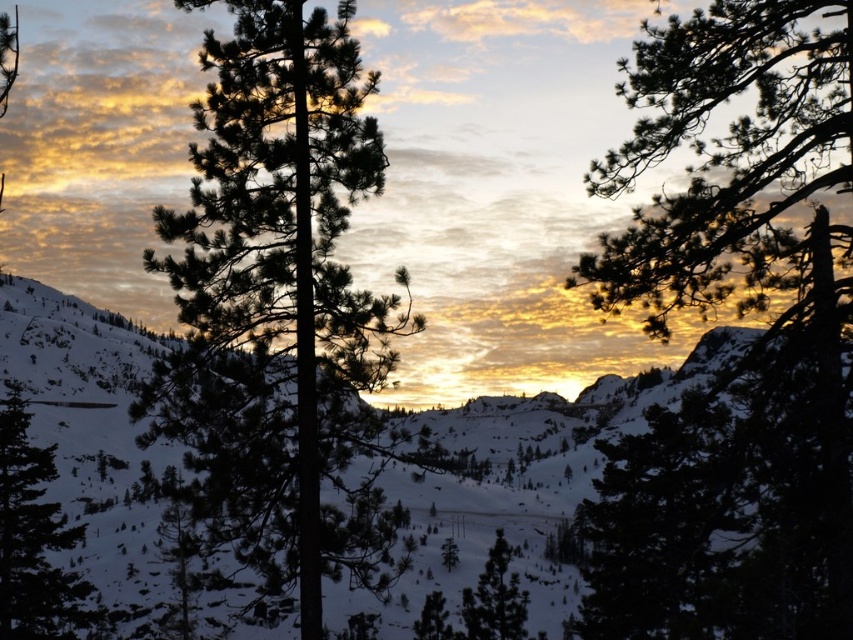
Question: Estimate the real-world distances between objects in this image. Which object is closer to the green matte tree at lower left?

Choices:
 (A) green matte tree at center
 (B) dark green pine tree at center

Answer: (B)

Question: Which object appears closest to the camera in this image?

Choices:
 (A) dark green pine tree at center
 (B) green matte tree at center
 (C) green matte tree at lower left

Answer: (A)

Question: Does green textured pine tree at upper right have a larger size compared to green matte tree at center?

Choices:
 (A) no
 (B) yes

Answer: (B)

Question: Which point is closer to the camera?

Choices:
 (A) (32, 556)
 (B) (491, 564)
 (C) (805, 500)

Answer: (C)

Question: Does green textured pine tree at upper right lie in front of green matte tree at center?

Choices:
 (A) no
 (B) yes

Answer: (B)

Question: Does green matte tree at lower left have a greater width compared to green matte tree at center?

Choices:
 (A) yes
 (B) no

Answer: (A)